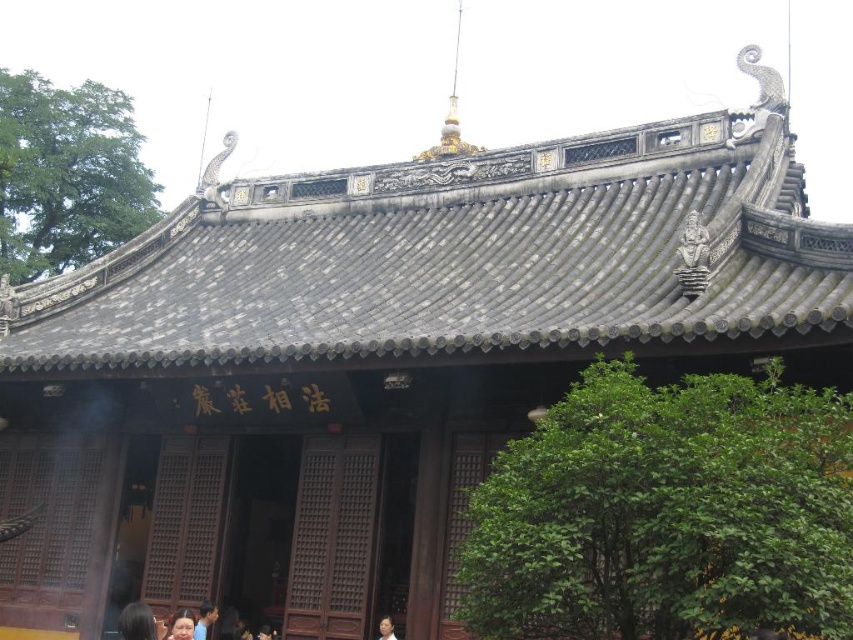
Which is above, smooth skin face at lower center or smooth brown hair at lower center?

smooth skin face at lower center is higher up.

Does point (192, 627) come farther from viewer compared to point (380, 624)?

That is False.

Image resolution: width=853 pixels, height=640 pixels. What are the coordinates of `smooth skin face at lower center` in the screenshot? It's located at (180, 628).

Who is more distant from viewer, (201,630) or (392,618)?

The point (201,630) is more distant.

Is point (198, 630) positioned in front of point (392, 621)?

No, (198, 630) is behind (392, 621).

The height and width of the screenshot is (640, 853). What do you see at coordinates (204, 620) in the screenshot?
I see `blue shirt at lower center` at bounding box center [204, 620].

Locate an element on the screen. The height and width of the screenshot is (640, 853). blue shirt at lower center is located at coordinates point(204,620).

Which is more to the left, blue shirt at lower center or smooth skin face at lower center?

smooth skin face at lower center

What do you see at coordinates (204, 620) in the screenshot?
I see `blue shirt at lower center` at bounding box center [204, 620].

Who is more distant from viewer, (204, 628) or (186, 628)?

Positioned behind is point (204, 628).

Locate an element on the screen. The image size is (853, 640). blue shirt at lower center is located at coordinates (204, 620).